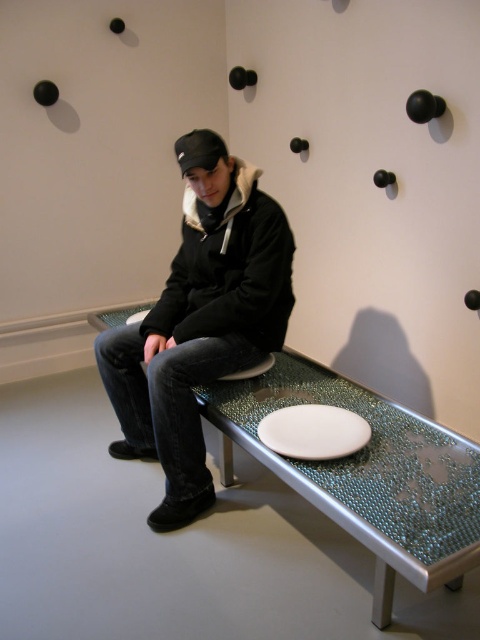
Is black matte jacket at center behind white glossy plate at center?

No, it is not.

Is black matte jacket at center taller than white glossy plate at center?

Correct, black matte jacket at center is much taller as white glossy plate at center.

I want to click on black matte jacket at center, so click(200, 321).

Which is above, black matte jacket at center or translucent glass bench at center?

black matte jacket at center

Can you confirm if black matte jacket at center is bigger than translucent glass bench at center?

Indeed, black matte jacket at center has a larger size compared to translucent glass bench at center.

This screenshot has height=640, width=480. I want to click on black matte jacket at center, so click(x=200, y=321).

Which is more to the right, translucent glass bench at center or white glossy plate at center?

translucent glass bench at center is more to the right.

Locate an element on the screen. This screenshot has width=480, height=640. translucent glass bench at center is located at coordinates (367, 474).

The image size is (480, 640). Find the location of `translucent glass bench at center`. translucent glass bench at center is located at coordinates (367, 474).